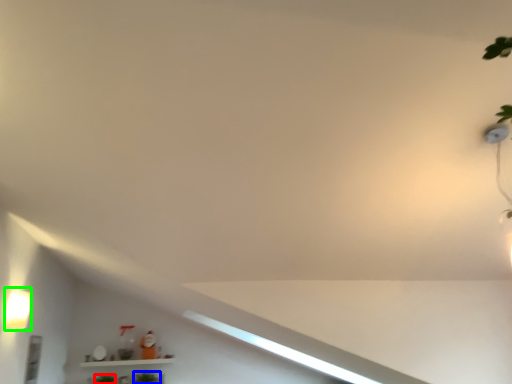
Question: Which object is positioned closest to plant (highlighted by a red box)? Select from plant (highlighted by a blue box) and light fixture (highlighted by a green box).

Choices:
 (A) plant
 (B) light fixture

Answer: (A)